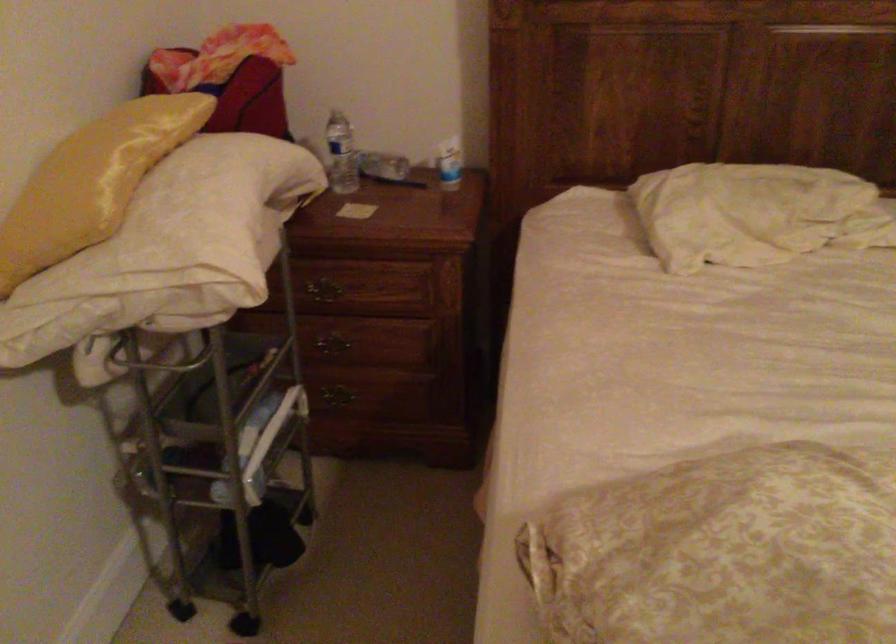
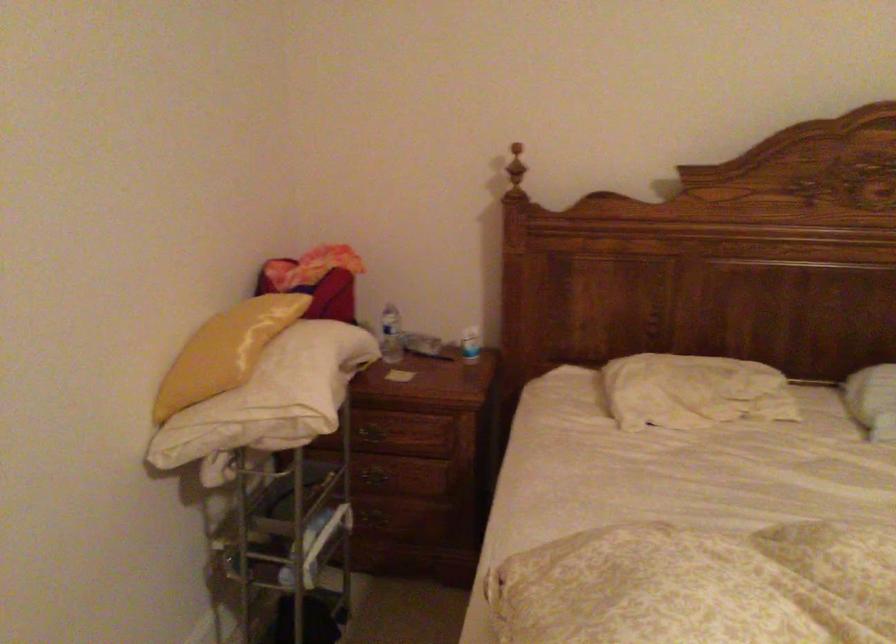
Where in the second image is the point corresponding to (x=446, y=164) from the first image?

(470, 344)